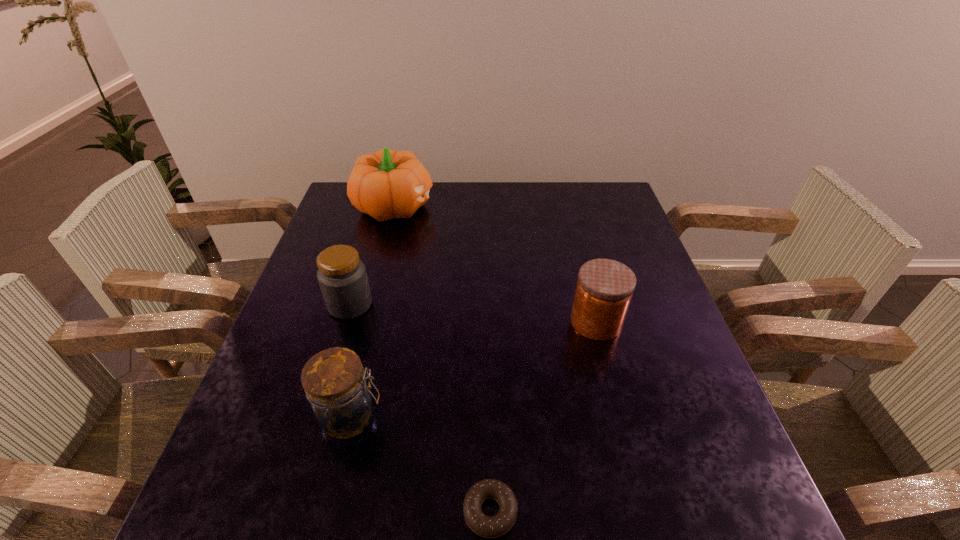
The height and width of the screenshot is (540, 960). Find the location of `free spot between the nearest jar and the tallest object`. free spot between the nearest jar and the tallest object is located at coordinates (372, 311).

Choose which object is the fourth nearest neighbor to the tallest object. Please provide its 2D coordinates. Your answer should be formatted as a tuple, i.e. [(x, y)], where the tuple contains the x and y coordinates of a point satisfying the conditions above.

[(485, 526)]

The image size is (960, 540). In order to click on the second closest object to the shortest object in this screenshot , I will do `click(605, 287)`.

At what (x,y) coordinates should I click in order to perform the action: click on the third closest jar to the shortest object. Please return your answer as a coordinate pair (x, y). Looking at the image, I should click on (342, 277).

Identify which jar is located as the second nearest to the rightmost object. Please provide its 2D coordinates. Your answer should be formatted as a tuple, i.e. [(x, y)], where the tuple contains the x and y coordinates of a point satisfying the conditions above.

[(342, 277)]

Where is `free space that satisfies the following two spatial constraints: 1. on the carved face of the pumpkin; 2. on the right side of the rightmost jar`? This screenshot has height=540, width=960. free space that satisfies the following two spatial constraints: 1. on the carved face of the pumpkin; 2. on the right side of the rightmost jar is located at coordinates (365, 322).